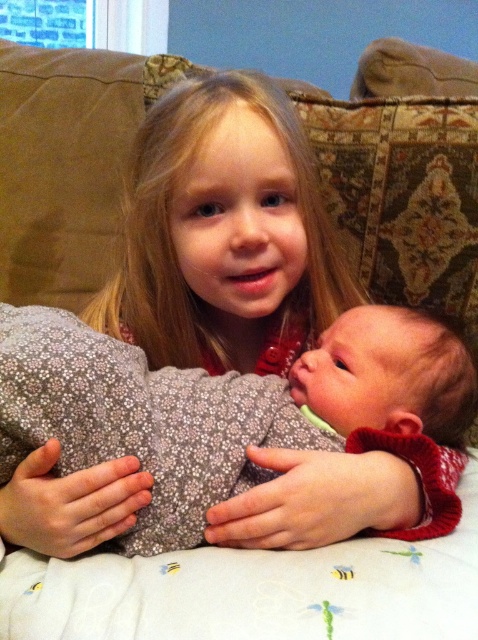
Is fluffy gray blanket at center bigger than blonde hair at upper center?

No, fluffy gray blanket at center is not bigger than blonde hair at upper center.

Can you confirm if fluffy gray blanket at center is wider than blonde hair at upper center?

Indeed, fluffy gray blanket at center has a greater width compared to blonde hair at upper center.

Between point (267, 392) and point (99, 328), which one is positioned in front?

Point (267, 392) is more forward.

At what (x,y) coordinates should I click in order to perform the action: click on fluffy gray blanket at center. Please return your answer as a coordinate pair (x, y). This screenshot has width=478, height=640. Looking at the image, I should click on (239, 416).